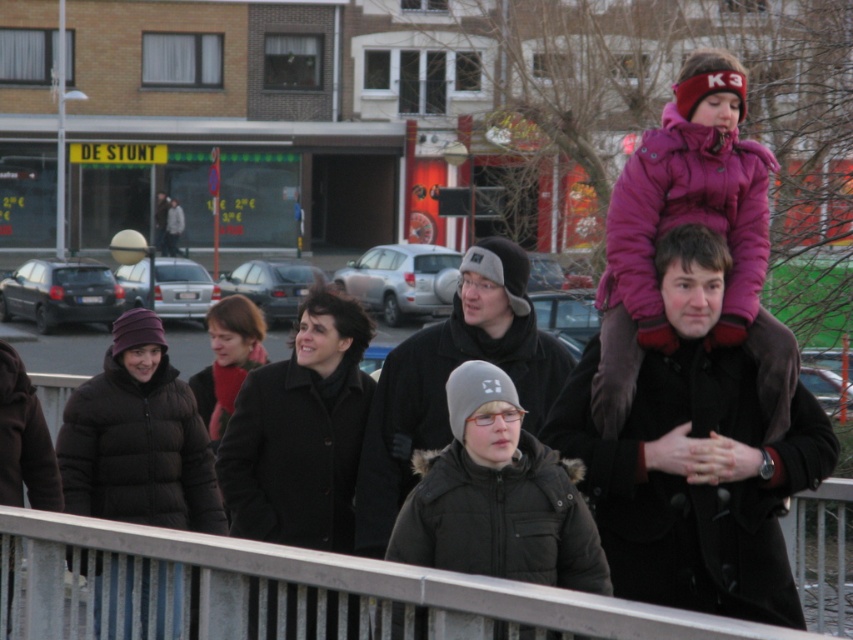
Question: Which of the following is the closest to the observer?

Choices:
 (A) (410, 481)
 (B) (296, 464)

Answer: (A)

Question: Does purple fuzzy coat at upper right appear on the left side of black puffy coat at lower left?

Choices:
 (A) yes
 (B) no

Answer: (B)

Question: Can you confirm if metal at center is thinner than matte black coat at center?

Choices:
 (A) yes
 (B) no

Answer: (B)

Question: Is metal at center positioned at the back of black wool coat at center?

Choices:
 (A) no
 (B) yes

Answer: (A)

Question: Which object is farther from the camera taking this photo?

Choices:
 (A) black puffy coat at lower left
 (B) metal at center

Answer: (A)

Question: Considering the real-world distances, which object is farthest from the black puffy coat at lower left?

Choices:
 (A) metal at center
 (B) purple fuzzy coat at upper right

Answer: (B)